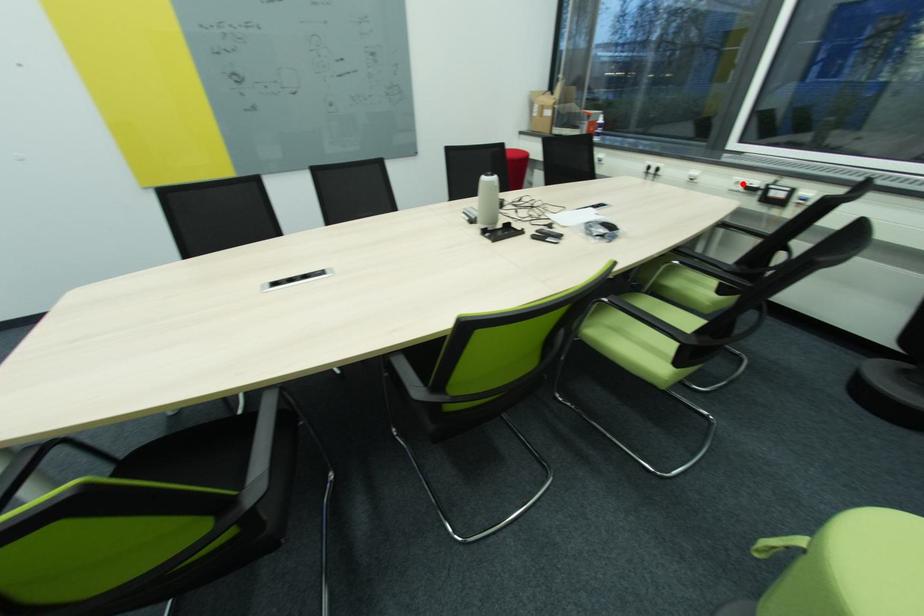
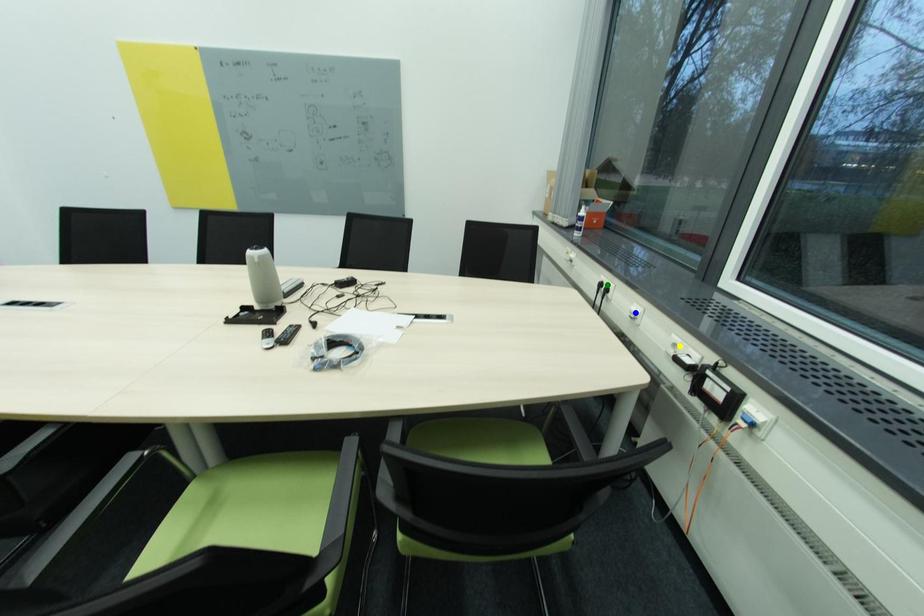
Question: I am providing you with two images of the same scene from different viewpoints. A red point is marked on the first image. You are given multiple points on the second image. Can you choose the point in image 2 that corresponds to the point in image 1?

Choices:
 (A) green point
 (B) yellow point
 (C) blue point

Answer: (B)